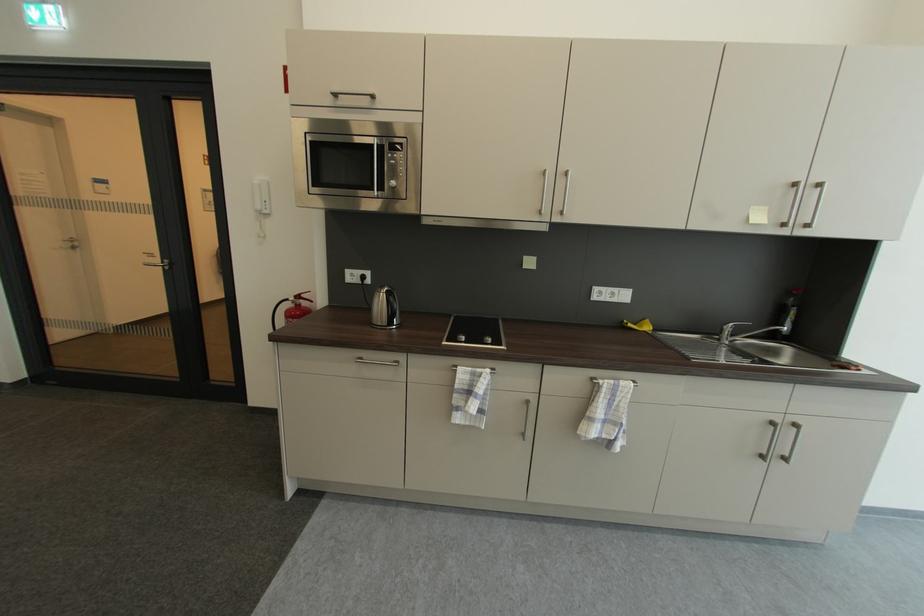
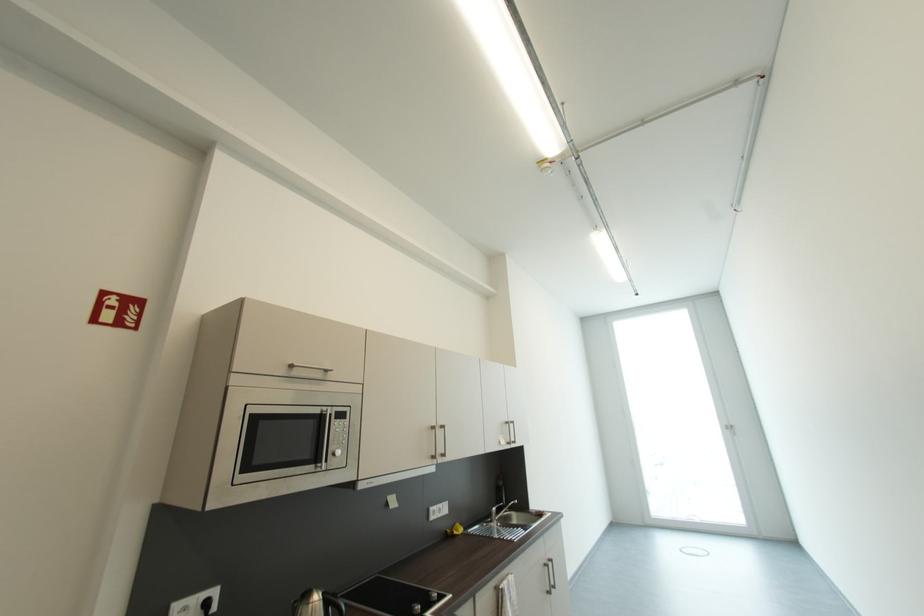
Where in the second image is the point corresponding to point (629, 323) from the first image?

(454, 533)